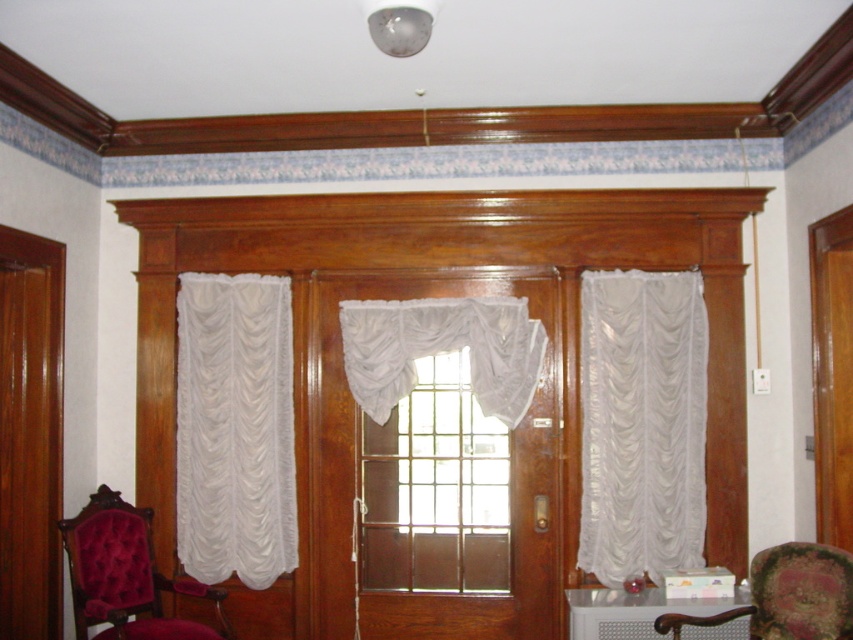
Is point (223, 504) positioned behind point (474, 342)?

That is True.

Can you confirm if white sheer curtain at left is positioned to the left of white sheer curtain at center?

Correct, you'll find white sheer curtain at left to the left of white sheer curtain at center.

Locate an element on the screen. The width and height of the screenshot is (853, 640). white sheer curtain at left is located at coordinates (235, 428).

Between white sheer curtain at right and white sheer curtain at left, which one appears on the right side from the viewer's perspective?

Positioned to the right is white sheer curtain at right.

Consider the image. Does white sheer curtain at right come in front of white sheer curtain at left?

Yes, it is in front of white sheer curtain at left.

Locate an element on the screen. The width and height of the screenshot is (853, 640). white sheer curtain at right is located at coordinates (641, 422).

Does white sheer curtain at right have a lesser height compared to white sheer curtain at center?

In fact, white sheer curtain at right may be taller than white sheer curtain at center.

Between white sheer curtain at right and white sheer curtain at center, which one has more height?

With more height is white sheer curtain at right.

Measure the distance between white sheer curtain at right and camera.

white sheer curtain at right is 12.69 feet away from camera.

You are a GUI agent. You are given a task and a screenshot of the screen. Output one action in this format:
    pyautogui.click(x=<x>, y=<y>)
    Task: Click on the white sheer curtain at right
    The height and width of the screenshot is (640, 853).
    Given the screenshot: What is the action you would take?
    pyautogui.click(x=641, y=422)